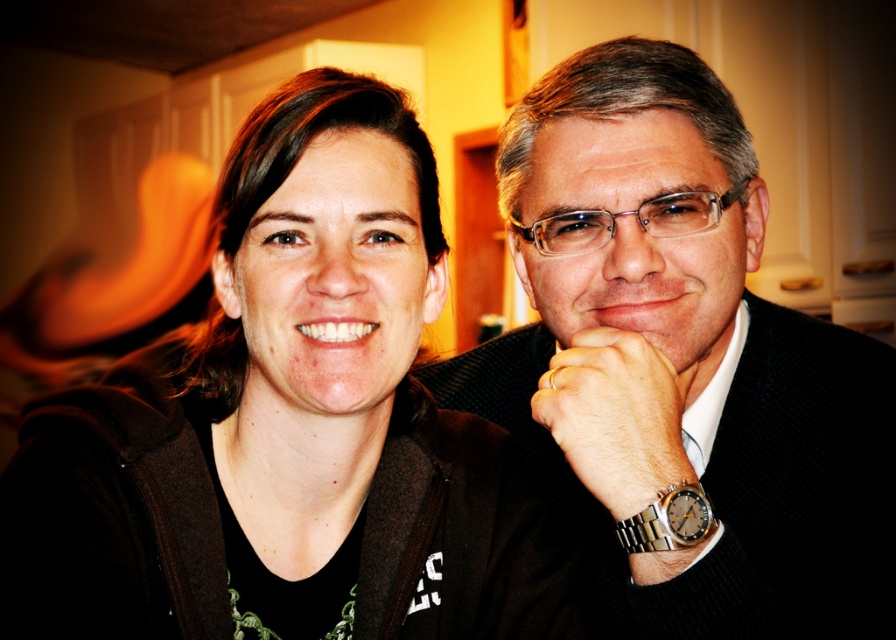
You are a fashion designer observing the image and need to decide which item can be placed inside a small jewelry box. Based on their sizes, which item between the black textured suit at center and the metallic gold ring at center is more suitable for the box?

The metallic gold ring at center is more suitable for the small jewelry box because it is smaller than the black textured suit at center.

You are a photographer adjusting the lighting in the studio. You notice the matte black jacket at left and the metallic gold ring at center in your frame. Which object is closer to the camera?

The matte black jacket at left is closer to the camera than the metallic gold ring at center because it is in front of it.